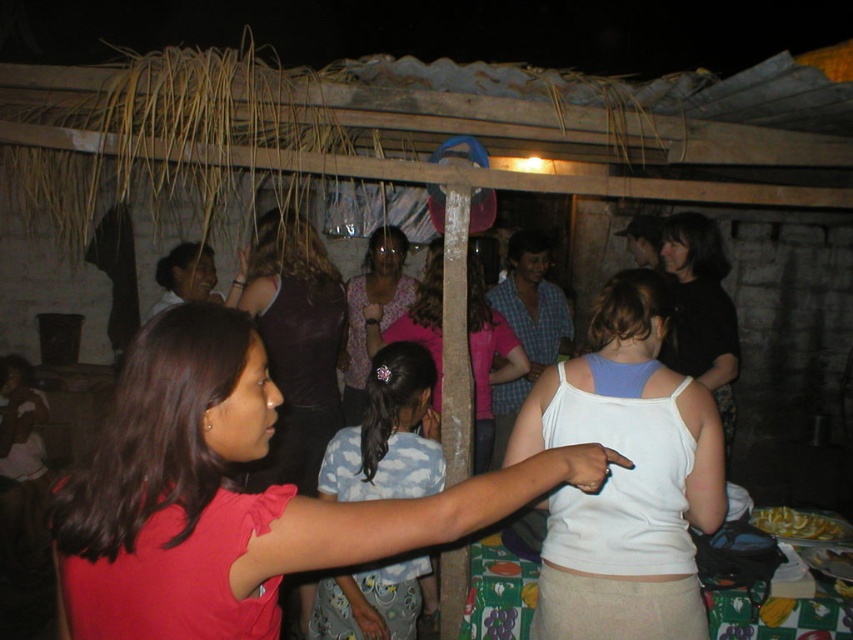
Question: Which point is closer to the camera?

Choices:
 (A) blue cotton shirt at center
 (B) white fabric tank top at center

Answer: (B)

Question: Does pink fabric shirt at center have a larger size compared to white fabric tank top at center?

Choices:
 (A) no
 (B) yes

Answer: (B)

Question: Which point is closer to the camera?

Choices:
 (A) (610, 435)
 (B) (306, 266)
 (C) (424, 317)

Answer: (A)

Question: Observing the image, what is the correct spatial positioning of blue cotton shirt at center in reference to floral fabric blouse at center?

Choices:
 (A) right
 (B) left

Answer: (A)

Question: Can you confirm if pink fabric shirt at center is thinner than blue cotton shirt at center?

Choices:
 (A) no
 (B) yes

Answer: (A)

Question: Which point is farther from the camera taking this photo?

Choices:
 (A) (374, 228)
 (B) (393, 454)

Answer: (A)